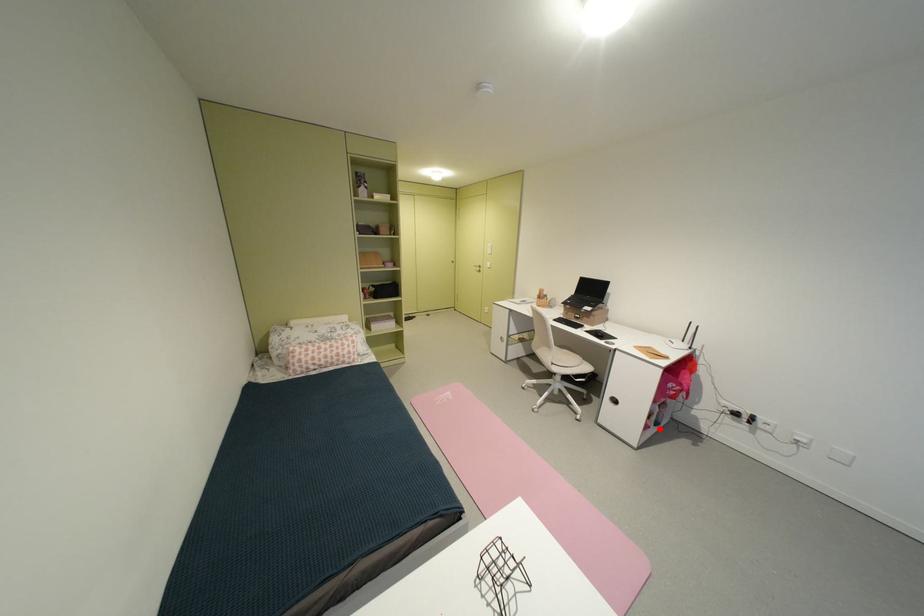
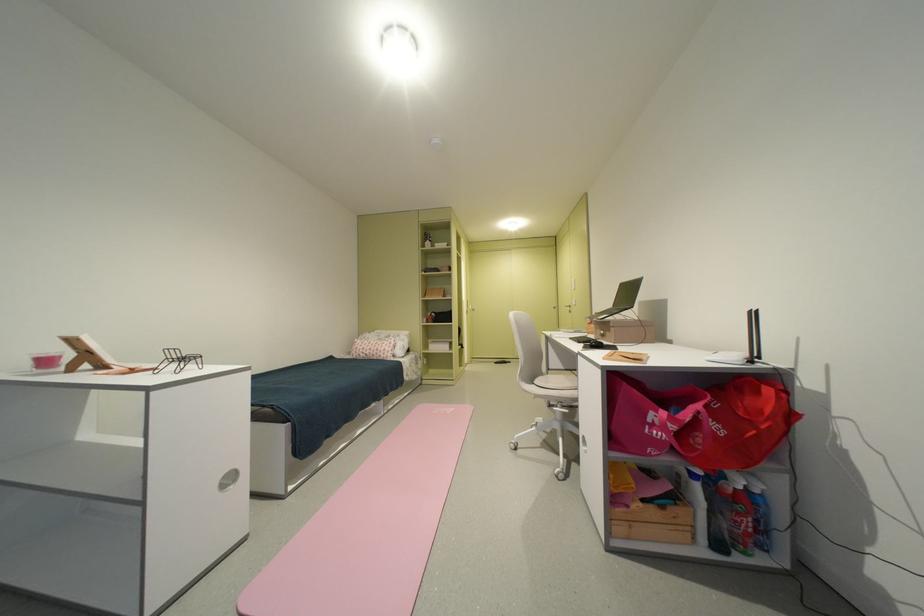
Question: I am providing you with two images of the same scene from different viewpoints. Image1 has a red point marked. In image2, the corresponding 3D location appears at what relative position? Reply with the corresponding letter.

Choices:
 (A) Closer
 (B) Farther

Answer: (A)